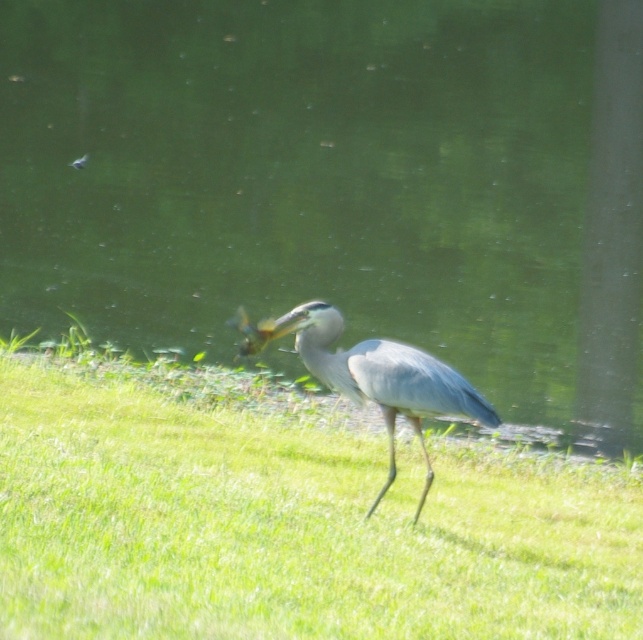
You are a birdwatcher trying to determine the best spot to observe the heron without disturbing it. You notice the green water at center and the green grass at center. Which area is wider, and why might that matter for your observation?

The green water at center is wider than the green grass at center. This might matter because a wider area could offer a more stable or spacious location for observation, potentially allowing you to stay farther away from the heron while still having a clear view.

You are a photographer trying to capture the gray matte heron at center and the green grass at center in a single shot. Based on their sizes in the image, which one would appear larger in your photo?

The gray matte heron at center appears larger than the green grass at center in the image because the description states that the green grass at center is smaller than the gray matte heron at center.